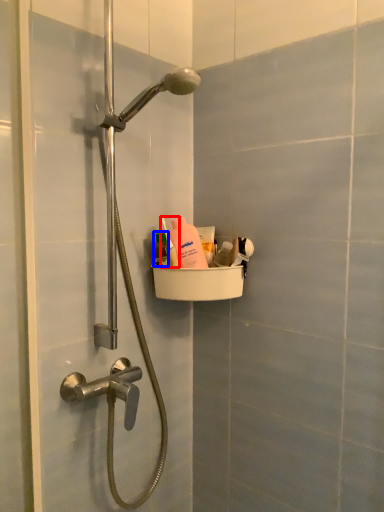
Question: Which object is further to the camera taking this photo, toiletry (highlighted by a red box) or mouthwash (highlighted by a blue box)?

Choices:
 (A) toiletry
 (B) mouthwash

Answer: (B)